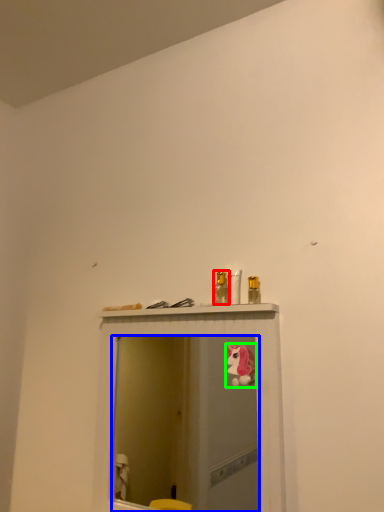
Question: Which is nearer to the toiletry (highlighted by a red box)? mirror (highlighted by a blue box) or animal (highlighted by a green box).

Choices:
 (A) mirror
 (B) animal

Answer: (B)